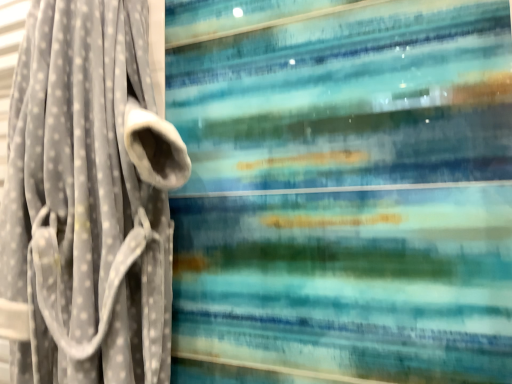
What do you see at coordinates (88, 200) in the screenshot?
I see `gray velvety curtain at left` at bounding box center [88, 200].

This screenshot has height=384, width=512. Identify the location of gray velvety curtain at left. click(x=88, y=200).

What is the approximate width of gray velvety curtain at left?

gray velvety curtain at left is 5.06 inches in width.

This screenshot has height=384, width=512. In order to click on gray velvety curtain at left in this screenshot , I will do `click(88, 200)`.